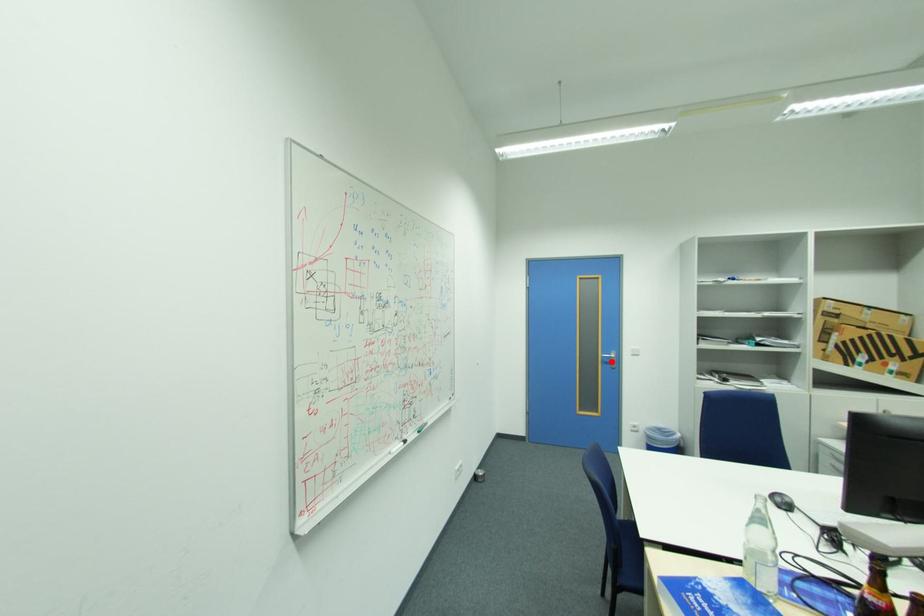
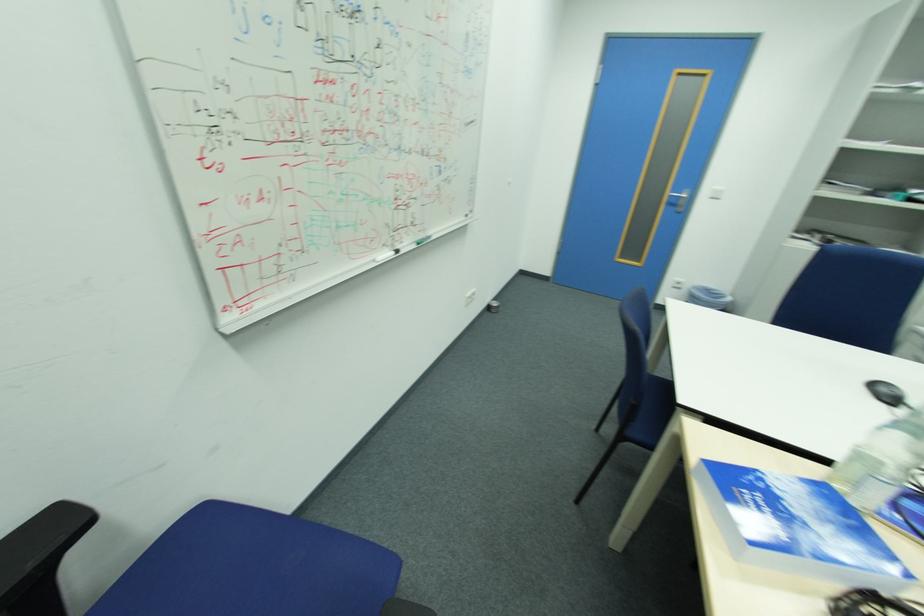
Find the pixel in the second image that matches the highlighted location in the first image.

(678, 203)